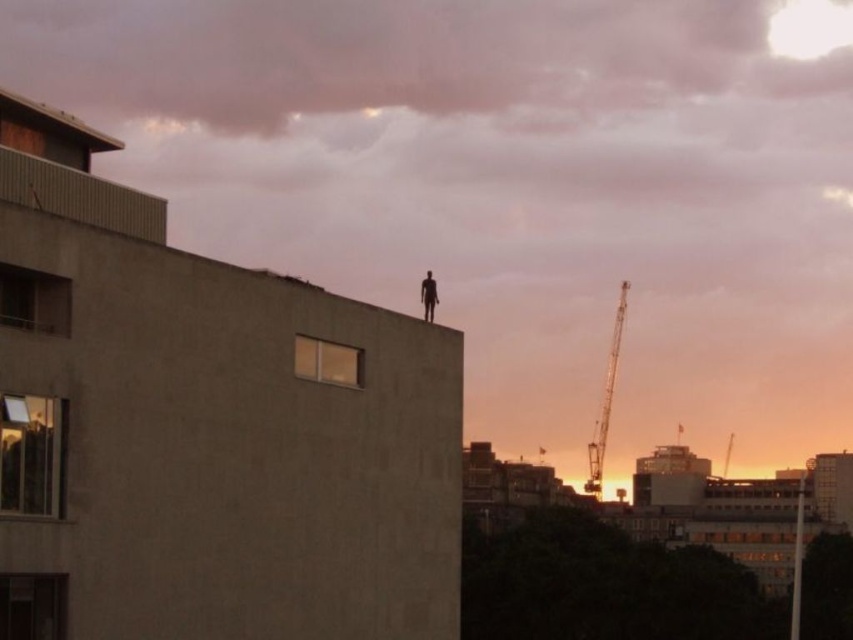
Question: Which point appears closest to the camera in this image?

Choices:
 (A) pos(605,436)
 (B) pos(669,88)

Answer: (A)

Question: Estimate the real-world distances between objects in this image. Which object is farther from the metallic gray crane at right?

Choices:
 (A) silhouette figure at center
 (B) pink fluffy cloud at upper center

Answer: (A)

Question: Can you confirm if pink fluffy cloud at upper center is positioned below silhouette figure at center?

Choices:
 (A) yes
 (B) no

Answer: (B)

Question: Based on their relative distances, which object is farther from the pink fluffy cloud at upper center?

Choices:
 (A) metallic gray crane at right
 (B) silhouette figure at center

Answer: (B)

Question: Does pink fluffy cloud at upper center have a larger size compared to silhouette figure at center?

Choices:
 (A) no
 (B) yes

Answer: (B)

Question: Observing the image, what is the correct spatial positioning of pink fluffy cloud at upper center in reference to metallic gray crane at right?

Choices:
 (A) right
 (B) left

Answer: (B)